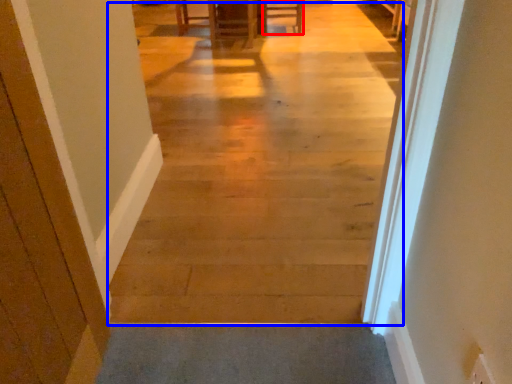
Question: Which object appears closest to the camera in this image, furniture (highlighted by a red box) or aisle (highlighted by a blue box)?

Choices:
 (A) furniture
 (B) aisle

Answer: (B)